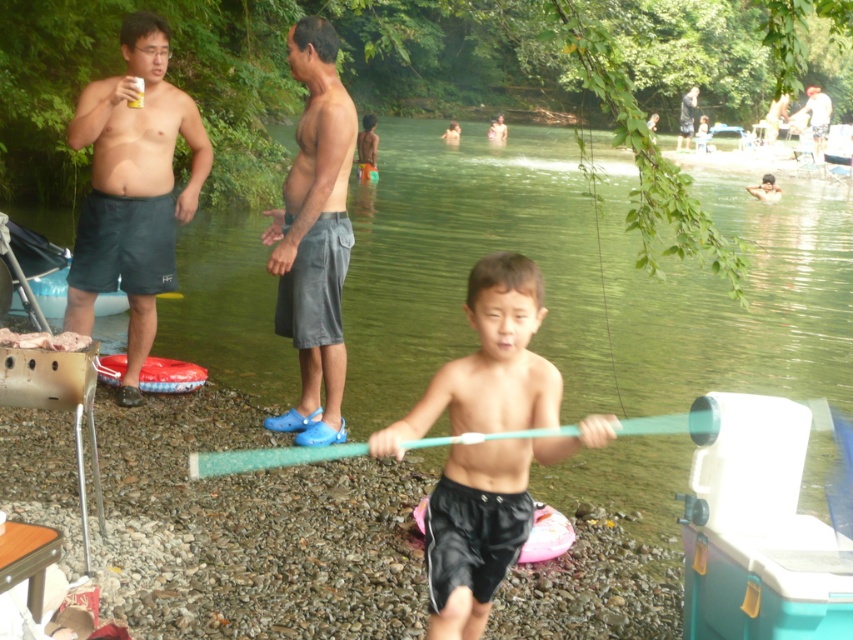
You are a photographer standing at the edge of the river. You want to take a photo that includes both the gray fabric shorts at center and the smooth blue shorts at center. Given that your camera has a maximum focus range of 120 feet, will you be able to capture both subjects in focus without moving closer?

The distance between the gray fabric shorts at center and smooth blue shorts at center is 122.56 feet. Since your camera can only focus up to 120 feet, you won cannot capture both subjects in focus without moving closer.

You are organizing a clothing swap event and need to categorize items based on their size. You have two pairs of shorts here labeled as black matte shorts at center and smooth blue shorts at center. Which pair has a larger width?

The black matte shorts at center has a larger width than the smooth blue shorts at center according to the description.

From the picture: You are a photographer trying to capture the black matte shorts at center in your shot. What are the exact coordinates where you should focus your camera?

The black matte shorts at center are located at coordinates point (x=485, y=522).